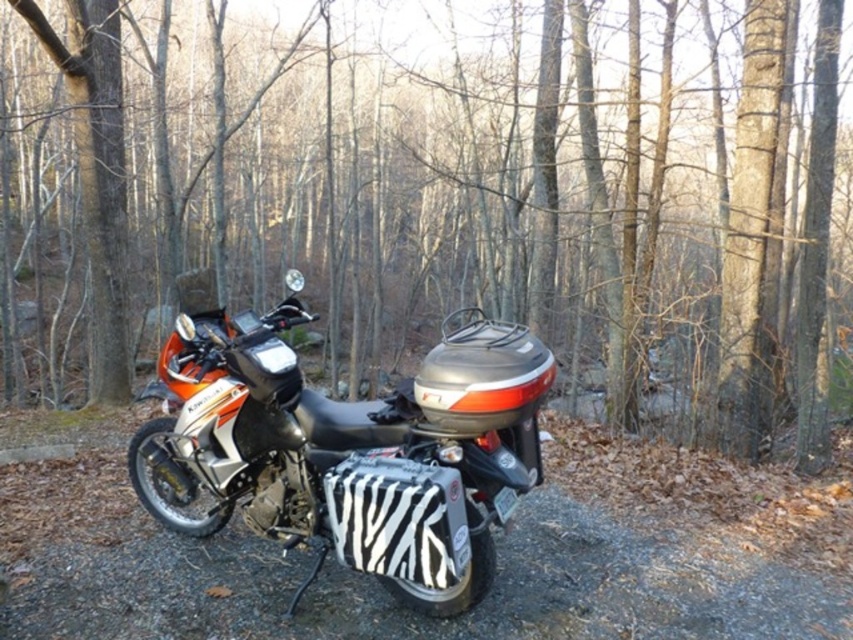
You are a photographer standing in front of the motorcycle. You want to take a photo that includes both the point at coordinates point (x=102, y=172) and point (x=466, y=563). Which point should you focus on to ensure both are in sharp focus?

You should focus on point (x=102, y=172) because it is closer to the camera than point (x=466, y=563). By focusing on the closer point, the depth of field will likely include the farther point as well, ensuring both are in focus.

You are standing on the gravel path in the forest and want to know how far the point at coordinates (564, 141) is from you. Can you determine the distance?

The point at coordinates (564, 141) is 44.75 feet away from you.